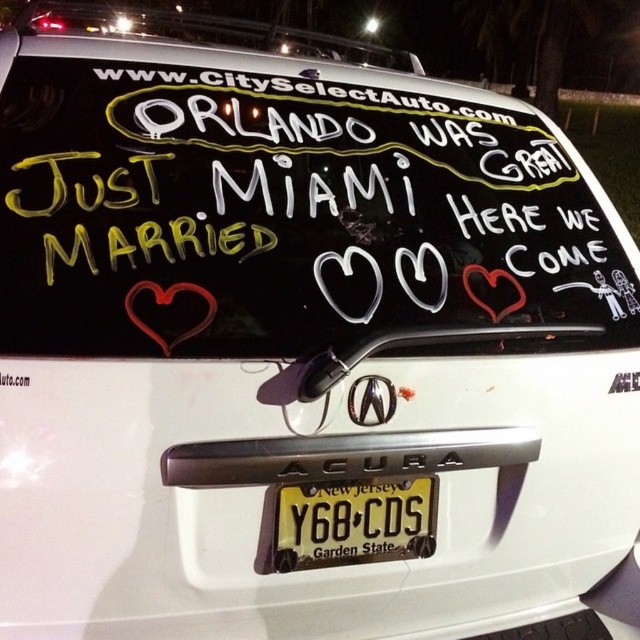
Question: Is yellow metallic license plate at center further to camera compared to white matte signboard at upper center?

Choices:
 (A) no
 (B) yes

Answer: (A)

Question: Which point is closer to the camera?

Choices:
 (A) matte red heart at center right
 (B) white matte signboard at upper center
 (C) matte red heart at center
 (D) yellow metallic license plate at center

Answer: (C)

Question: Does black matte signboard at upper center appear under matte red heart at center right?

Choices:
 (A) no
 (B) yes

Answer: (A)

Question: Estimate the real-world distances between objects in this image. Which object is closer to the white matte signboard at upper center?

Choices:
 (A) matte red heart at center
 (B) yellow metallic license plate at center
 (C) matte red heart at center right
 (D) black matte signboard at upper center

Answer: (D)

Question: Can you confirm if matte red heart at center is positioned to the left of matte red heart at center right?

Choices:
 (A) yes
 (B) no

Answer: (A)

Question: Which object is positioned closest to the black matte signboard at upper center?

Choices:
 (A) matte red heart at center
 (B) yellow metallic license plate at center
 (C) white matte signboard at upper center

Answer: (A)